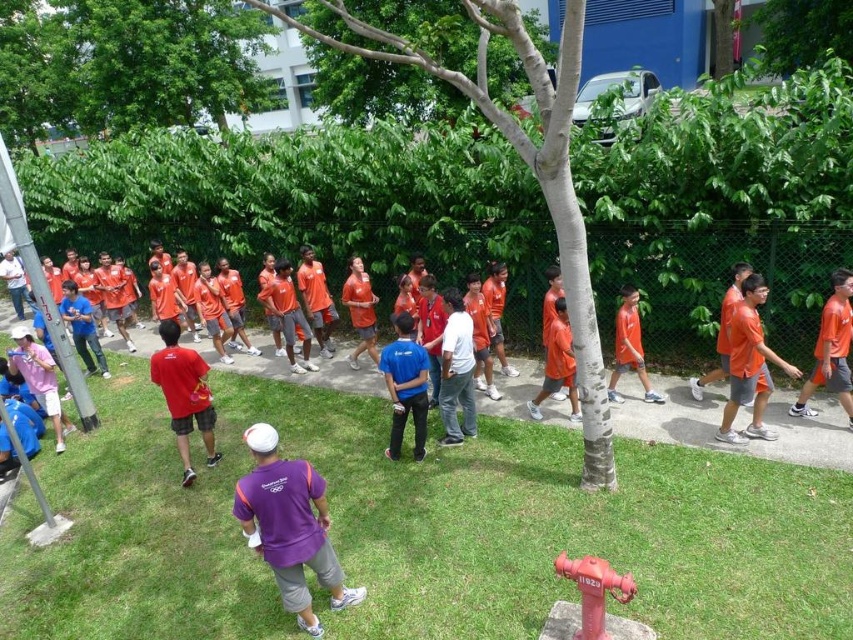
The image size is (853, 640). What are the coordinates of `green grass at lower center` in the screenshot? It's located at (419, 529).

You are a GUI agent. You are given a task and a screenshot of the screen. Output one action in this format:
    pyautogui.click(x=<x>, y=<y>)
    Task: Click on the green grass at lower center
    This screenshot has height=640, width=853.
    Given the screenshot: What is the action you would take?
    pyautogui.click(x=419, y=529)

Can you confirm if green leafy tree at upper left is positioned below green leafy tree at upper center?

Actually, green leafy tree at upper left is above green leafy tree at upper center.

At what (x,y) coordinates should I click in order to perform the action: click on green leafy tree at upper left. Please return your answer as a coordinate pair (x, y). This screenshot has height=640, width=853. Looking at the image, I should click on point(126,65).

At what (x,y) coordinates should I click in order to perform the action: click on green leafy tree at upper left. Please return your answer as a coordinate pair (x, y). Looking at the image, I should click on (126, 65).

Can you confirm if smooth bark tree at center is positioned to the right of matte blue shirt at center?

Correct, you'll find smooth bark tree at center to the right of matte blue shirt at center.

Can you confirm if smooth bark tree at center is bigger than matte blue shirt at center?

Yes.

Locate an element on the screen. The height and width of the screenshot is (640, 853). smooth bark tree at center is located at coordinates (525, 163).

You are a GUI agent. You are given a task and a screenshot of the screen. Output one action in this format:
    pyautogui.click(x=<x>, y=<y>)
    Task: Click on the smooth bark tree at center
    
    Given the screenshot: What is the action you would take?
    pyautogui.click(x=525, y=163)